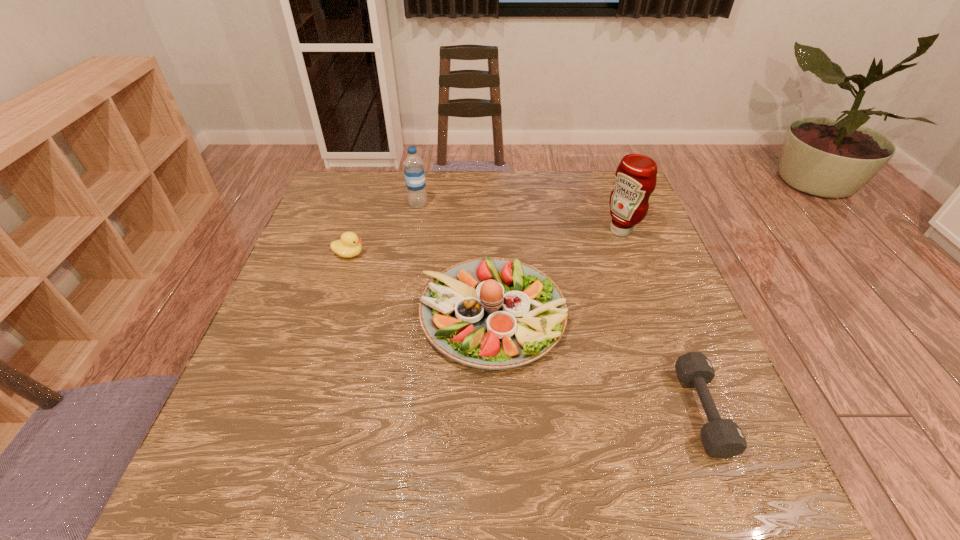
Locate an element on the screen. This screenshot has height=540, width=960. vacant area at the far edge of the desktop is located at coordinates (567, 174).

The width and height of the screenshot is (960, 540). I want to click on free point at the near edge, so click(x=312, y=481).

The width and height of the screenshot is (960, 540). I want to click on vacant space at the left edge, so pyautogui.click(x=215, y=455).

Image resolution: width=960 pixels, height=540 pixels. Identify the location of vacant space at the right edge of the desktop. (650, 224).

Where is `blank space at the far left corner`? The width and height of the screenshot is (960, 540). blank space at the far left corner is located at coordinates (332, 209).

Where is `free point at the far right corner`? Image resolution: width=960 pixels, height=540 pixels. free point at the far right corner is located at coordinates (608, 206).

In the image, there is a desktop. Where is `vacant area at the near right corner`? Image resolution: width=960 pixels, height=540 pixels. vacant area at the near right corner is located at coordinates [x=695, y=498].

At what (x,y) coordinates should I click in order to perform the action: click on vacant space that is in between the condiment and the farthest object. Please return your answer as a coordinate pair (x, y). The image size is (960, 540). Looking at the image, I should click on (519, 217).

Find the location of `free area in between the salad plate and the duckling`. free area in between the salad plate and the duckling is located at coordinates (420, 285).

The width and height of the screenshot is (960, 540). Find the location of `empty location between the dumbbell and the tallest object`. empty location between the dumbbell and the tallest object is located at coordinates (661, 321).